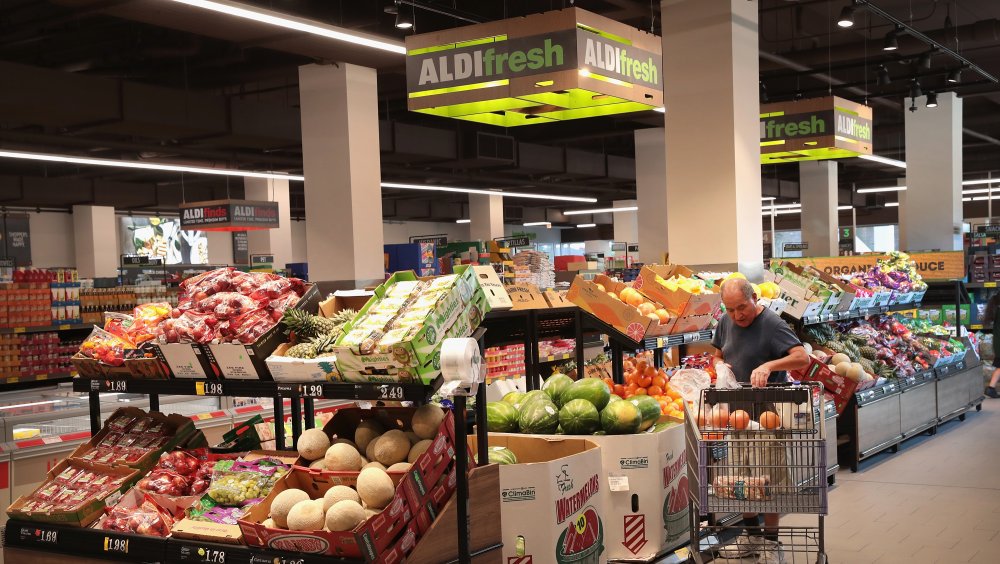
Image resolution: width=1000 pixels, height=564 pixels. What are the coordinates of `floor` in the screenshot? It's located at 908,500.